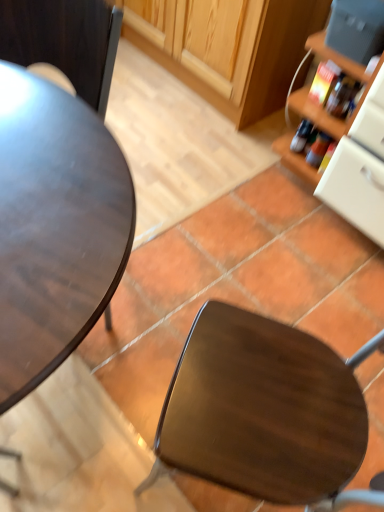
Question: From a real-world perspective, is matte dark wood desk at left positioned above or below translucent plastic bottle at right?

Choices:
 (A) below
 (B) above

Answer: (B)

Question: Is matte dark wood desk at left spatially inside translucent plastic bottle at right, or outside of it?

Choices:
 (A) outside
 (B) inside

Answer: (A)

Question: Which is nearer to the matte dark wood desk at left?

Choices:
 (A) wooden cabinet at upper center
 (B) translucent plastic bottle at right
 (C) matte gray toaster at upper right
 (D) shiny brown chair at center

Answer: (D)

Question: Which is nearer to the translucent plastic bottle at right?

Choices:
 (A) wooden cabinet at upper center
 (B) shiny brown chair at center
 (C) matte gray toaster at upper right
 (D) matte dark wood desk at left

Answer: (C)